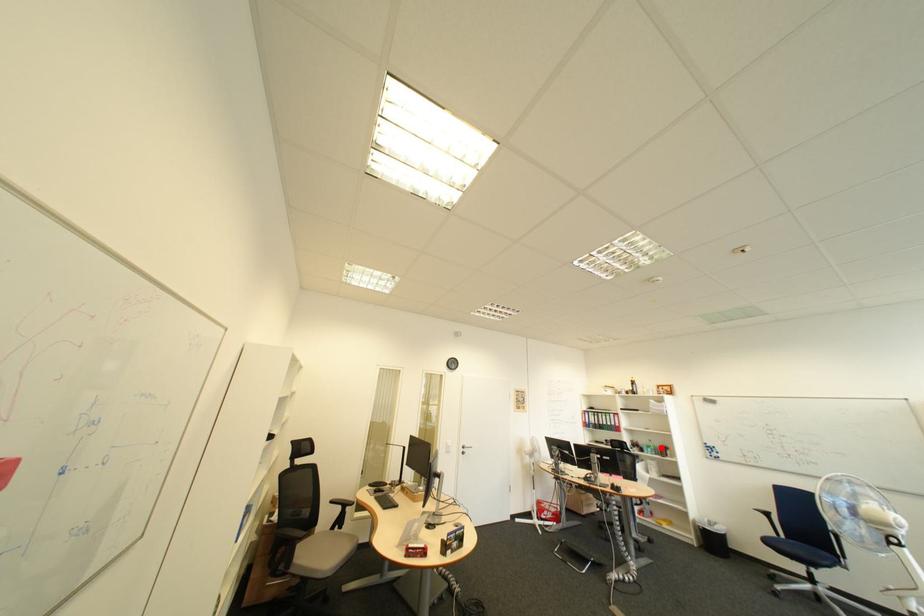
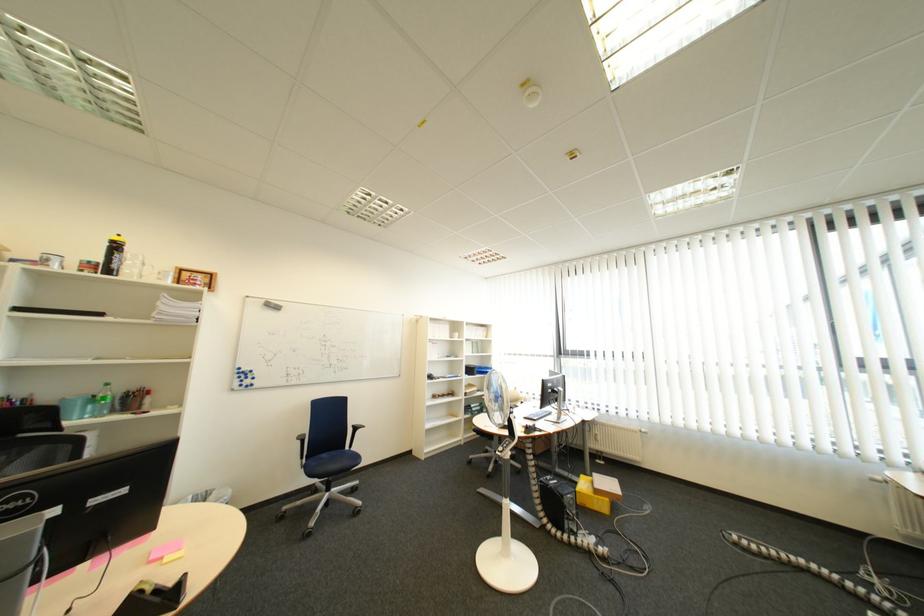
Question: I am providing you with two images of the same scene from different viewpoints. Given a red point in image1, look at the same physical point in image2. Is it:

Choices:
 (A) Closer to the viewpoint
 (B) Farther from the viewpoint

Answer: (A)